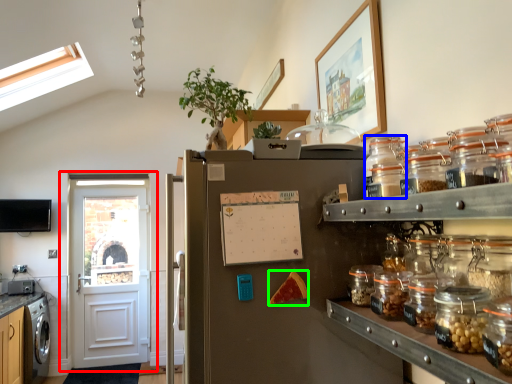
Question: Based on their relative distances, which object is nearer to door (highlighted by a red box)? Choose from glass jar (highlighted by a blue box) and food (highlighted by a green box).

Choices:
 (A) glass jar
 (B) food

Answer: (B)